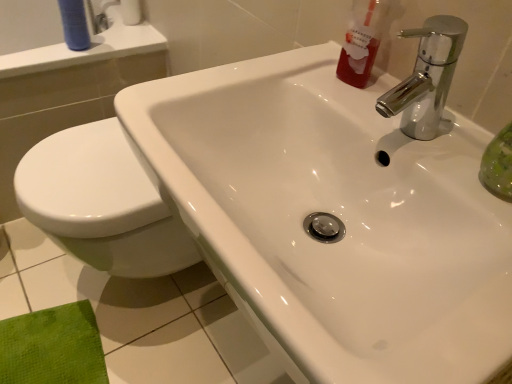
Question: Is blue matte tube at upper left positioned far away from translucent red liquid at upper right?

Choices:
 (A) no
 (B) yes

Answer: (A)

Question: Is blue matte tube at upper left bigger than translucent red liquid at upper right?

Choices:
 (A) yes
 (B) no

Answer: (B)

Question: From the image's perspective, would you say blue matte tube at upper left is positioned over translucent red liquid at upper right?

Choices:
 (A) yes
 (B) no

Answer: (A)

Question: Can you see blue matte tube at upper left touching translucent red liquid at upper right?

Choices:
 (A) no
 (B) yes

Answer: (A)

Question: Does blue matte tube at upper left contain translucent red liquid at upper right?

Choices:
 (A) yes
 (B) no

Answer: (B)

Question: In the image, is chrome metallic faucet at upper right positioned in front of or behind white paper towel at upper left?

Choices:
 (A) behind
 (B) front

Answer: (B)

Question: From the image's perspective, is chrome metallic faucet at upper right positioned above or below white paper towel at upper left?

Choices:
 (A) below
 (B) above

Answer: (A)

Question: From a real-world perspective, is chrome metallic faucet at upper right physically located above or below white paper towel at upper left?

Choices:
 (A) below
 (B) above

Answer: (B)

Question: In terms of width, does chrome metallic faucet at upper right look wider or thinner when compared to white paper towel at upper left?

Choices:
 (A) thin
 (B) wide

Answer: (B)

Question: Considering their positions, is chrome metallic faucet at upper right located in front of or behind blue matte tube at upper left?

Choices:
 (A) front
 (B) behind

Answer: (A)

Question: In terms of height, does chrome metallic faucet at upper right look taller or shorter compared to blue matte tube at upper left?

Choices:
 (A) short
 (B) tall

Answer: (A)

Question: Is chrome metallic faucet at upper right inside or outside of blue matte tube at upper left?

Choices:
 (A) outside
 (B) inside

Answer: (A)

Question: Looking at the image, does chrome metallic faucet at upper right seem bigger or smaller compared to blue matte tube at upper left?

Choices:
 (A) small
 (B) big

Answer: (B)

Question: Does point (136, 9) appear closer or farther from the camera than point (354, 56)?

Choices:
 (A) farther
 (B) closer

Answer: (A)

Question: In terms of height, does white paper towel at upper left look taller or shorter compared to translucent red liquid at upper right?

Choices:
 (A) tall
 (B) short

Answer: (B)